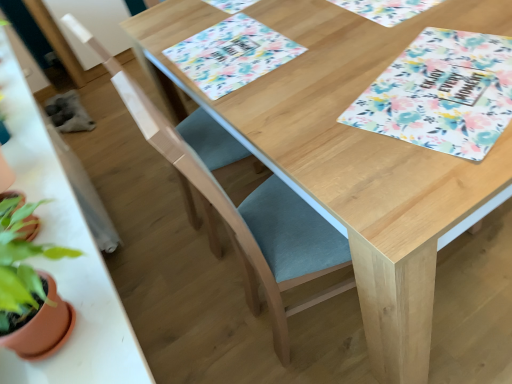
I want to click on vacant area that is in front of floral paper placemat at center, the first place mat viewed from the left, so click(x=304, y=95).